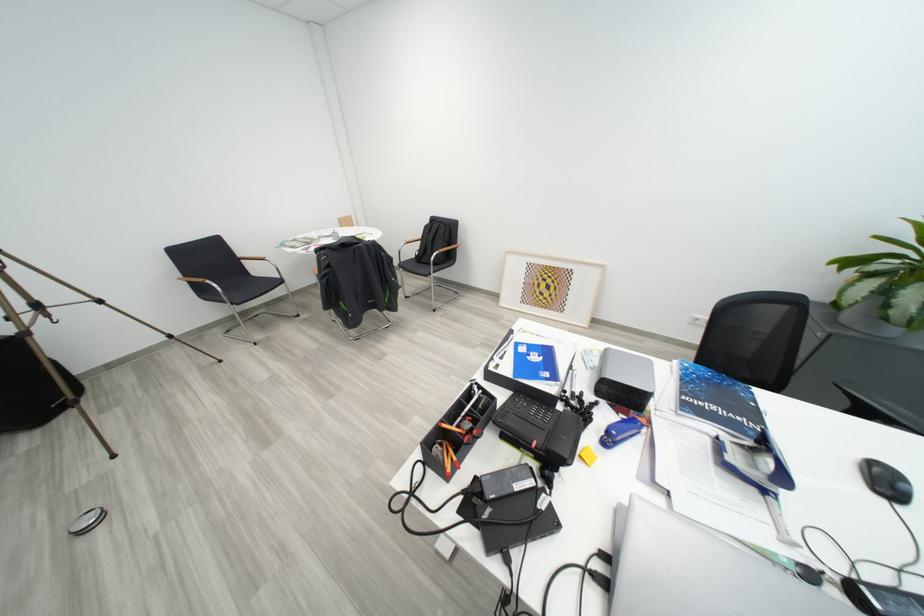
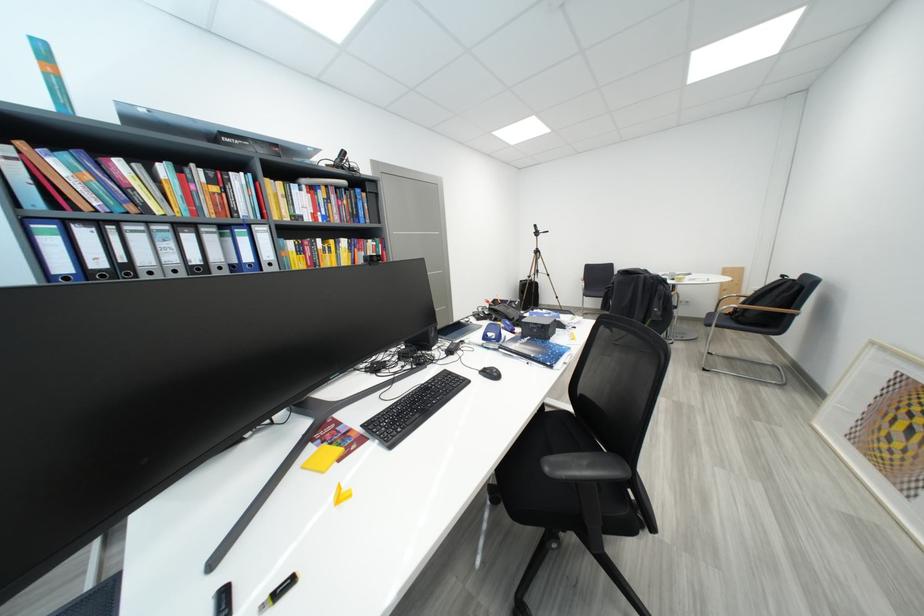
Question: I am providing you with two images of the same scene from different viewpoints. After the viewpoint changes to image2, which objects are now occluded?

Choices:
 (A) black chair surface
 (B) floral print tumbler
 (C) blue hole puncher
 (D) black chair armrest

Answer: (A)